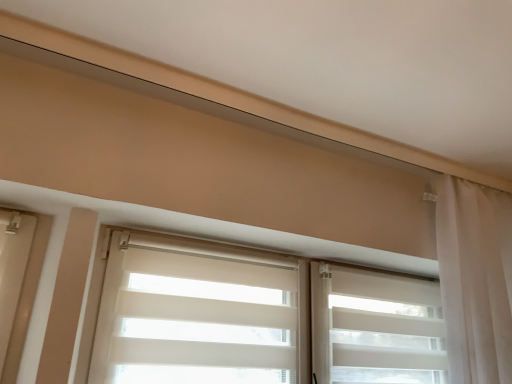
Question: Considering the relative positions of white matte/soft roller-shutter at center and white sheer curtain at right in the image provided, is white matte/soft roller-shutter at center to the left or to the right of white sheer curtain at right?

Choices:
 (A) right
 (B) left

Answer: (B)

Question: Looking at the image, does white matte/soft roller-shutter at center seem bigger or smaller compared to white sheer curtain at right?

Choices:
 (A) small
 (B) big

Answer: (A)

Question: Which of these objects is positioned farthest from the white matte/soft roller-shutter at center?

Choices:
 (A) white sheer curtain at center
 (B) white sheer curtain at right

Answer: (B)

Question: Considering the real-world distances, which object is farthest from the white matte/soft roller-shutter at center?

Choices:
 (A) white sheer curtain at center
 (B) white sheer curtain at right

Answer: (B)